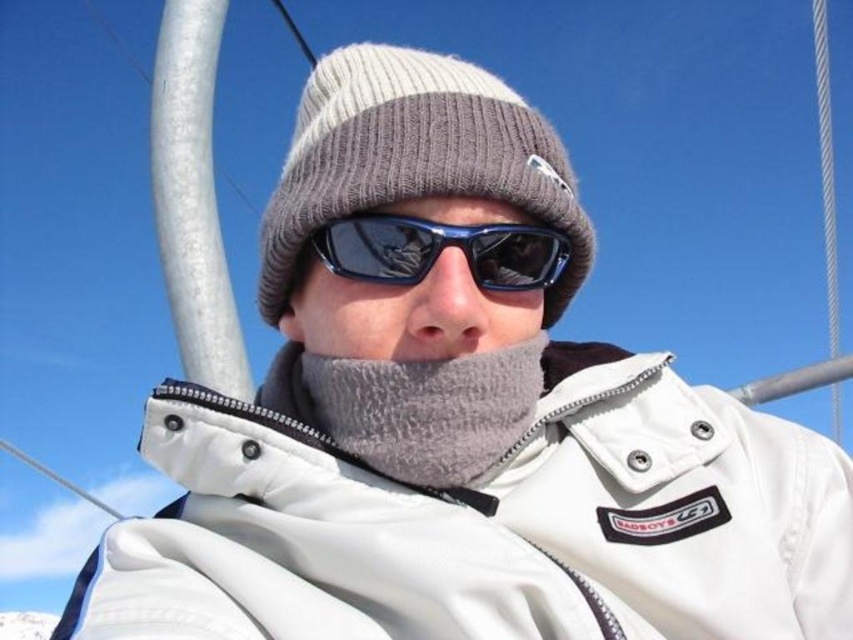
Is white fleece jacket at center positioned at the back of gray fuzzy scarf at center?

No, it is not.

Based on the photo, does white fleece jacket at center have a larger size compared to gray fuzzy scarf at center?

Correct, white fleece jacket at center is larger in size than gray fuzzy scarf at center.

Does point (213, 422) come farther from viewer compared to point (373, 396)?

No, it is not.

Locate an element on the screen. This screenshot has height=640, width=853. white fleece jacket at center is located at coordinates (482, 524).

From the picture: Between white fleece jacket at center and blue reflective plastic goggles at center, which one appears on the left side from the viewer's perspective?

blue reflective plastic goggles at center is more to the left.

Between white fleece jacket at center and blue reflective plastic goggles at center, which one has less height?

With less height is blue reflective plastic goggles at center.

Find the location of a particular element. white fleece jacket at center is located at coordinates (482, 524).

Is gray fuzzy scarf at center to the right of blue reflective plastic goggles at center from the viewer's perspective?

Incorrect, gray fuzzy scarf at center is not on the right side of blue reflective plastic goggles at center.

Is gray fuzzy scarf at center positioned before blue reflective plastic goggles at center?

That is False.

What do you see at coordinates (428, 410) in the screenshot? The height and width of the screenshot is (640, 853). I see `gray fuzzy scarf at center` at bounding box center [428, 410].

Locate an element on the screen. Image resolution: width=853 pixels, height=640 pixels. gray fuzzy scarf at center is located at coordinates point(428,410).